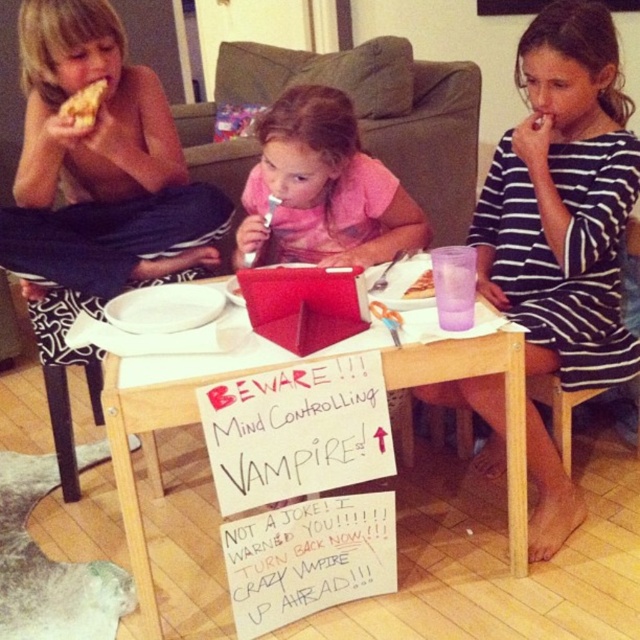
Can you confirm if matte black shorts at left is smaller than pink fabric shirt at center?

Incorrect, matte black shorts at left is not smaller in size than pink fabric shirt at center.

Who is taller, matte black shorts at left or pink fabric shirt at center?

matte black shorts at left is taller.

Between point (97, 12) and point (316, 204), which one is positioned behind?

Positioned behind is point (316, 204).

I want to click on matte black shorts at left, so click(97, 115).

Does wooden table at center lie behind golden crispy pizza slice at upper left?

No, wooden table at center is in front of golden crispy pizza slice at upper left.

Which of these two, wooden table at center or golden crispy pizza slice at upper left, stands taller?

With more height is wooden table at center.

Is point (380, 337) farther from viewer compared to point (72, 109)?

That is False.

The width and height of the screenshot is (640, 640). Identify the location of wooden table at center. (163, 428).

Between striped fabric dress at center and golden crispy pizza slice at upper left, which one appears on the right side from the viewer's perspective?

striped fabric dress at center

I want to click on striped fabric dress at center, so click(563, 200).

Is point (600, 49) behind point (70, 120)?

No.

Where is `striped fabric dress at center`? The width and height of the screenshot is (640, 640). striped fabric dress at center is located at coordinates (563, 200).